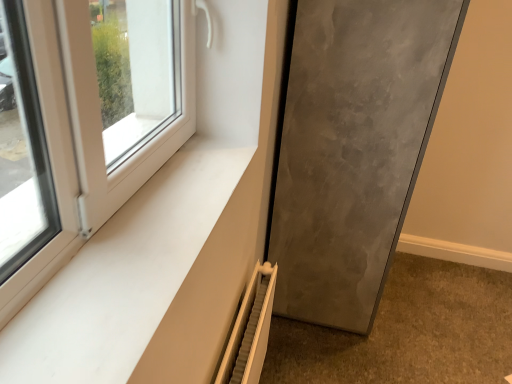
Question: Considering the relative sizes of matte gray door at lower right and white textured radiator at lower center in the image provided, is matte gray door at lower right taller than white textured radiator at lower center?

Choices:
 (A) no
 (B) yes

Answer: (B)

Question: Does matte gray door at lower right have a larger size compared to white textured radiator at lower center?

Choices:
 (A) yes
 (B) no

Answer: (A)

Question: Is matte gray door at lower right positioned beyond the bounds of white textured radiator at lower center?

Choices:
 (A) no
 (B) yes

Answer: (B)

Question: Are matte gray door at lower right and white textured radiator at lower center located far from each other?

Choices:
 (A) yes
 (B) no

Answer: (B)

Question: Does matte gray door at lower right have a lesser height compared to white textured radiator at lower center?

Choices:
 (A) yes
 (B) no

Answer: (B)

Question: Considering their positions, is matte gray door at lower right located in front of or behind white matte window sill at lower left?

Choices:
 (A) front
 (B) behind

Answer: (B)

Question: From a real-world perspective, is matte gray door at lower right above or below white matte window sill at lower left?

Choices:
 (A) above
 (B) below

Answer: (B)

Question: Considering the positions of matte gray door at lower right and white matte window sill at lower left in the image, is matte gray door at lower right bigger or smaller than white matte window sill at lower left?

Choices:
 (A) big
 (B) small

Answer: (A)

Question: Looking at their shapes, would you say matte gray door at lower right is wider or thinner than white matte window sill at lower left?

Choices:
 (A) wide
 (B) thin

Answer: (A)

Question: Is white matte window sill at lower left inside or outside of matte gray door at lower right?

Choices:
 (A) outside
 (B) inside

Answer: (A)

Question: From the image's perspective, is white matte window sill at lower left located above or below matte gray door at lower right?

Choices:
 (A) below
 (B) above

Answer: (A)

Question: Considering the positions of point (71, 354) and point (348, 26), is point (71, 354) closer or farther from the camera than point (348, 26)?

Choices:
 (A) farther
 (B) closer

Answer: (B)

Question: Relative to matte gray door at lower right, is white matte window sill at lower left in front or behind?

Choices:
 (A) behind
 (B) front

Answer: (B)

Question: From the image's perspective, is matte gray door at lower right located above or below white textured radiator at lower center?

Choices:
 (A) above
 (B) below

Answer: (A)

Question: From a real-world perspective, is matte gray door at lower right physically located above or below white textured radiator at lower center?

Choices:
 (A) above
 (B) below

Answer: (A)